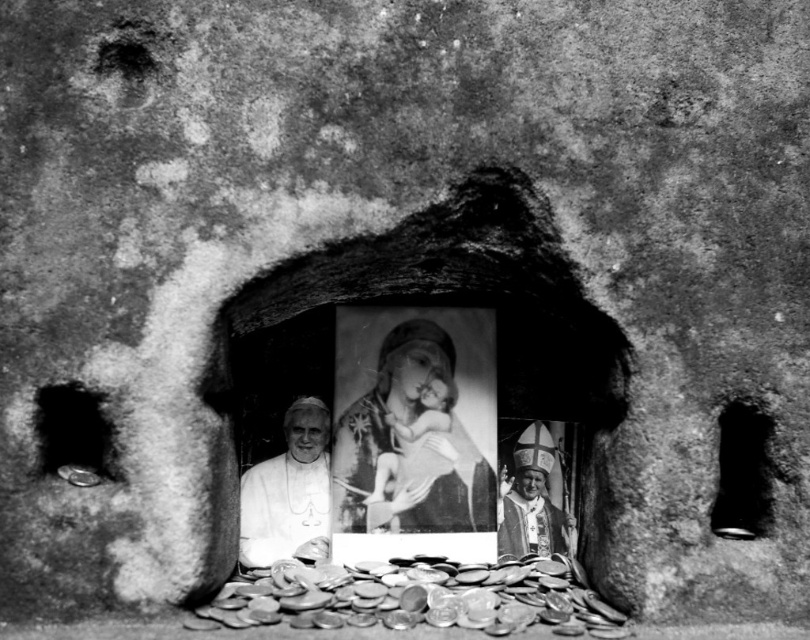
You are a visitor standing in front of the stone archway and want to place a new decoration between the shiny metallic coins at lower center and the white matte portrait at center. Based on their positions, where should you place the decoration to ensure it is between them?

The shiny metallic coins at lower center is in front of the white matte portrait at center, so to place the decoration between them, it should be positioned in front of the white matte portrait at center but behind the shiny metallic coins at lower center.

You are an art conservator examining this black and white photo. You notice the black matte hole at right and the smooth golden robe at center. Which object appears taller in the image?

The black matte hole at right appears taller than the smooth golden robe at center in the image.